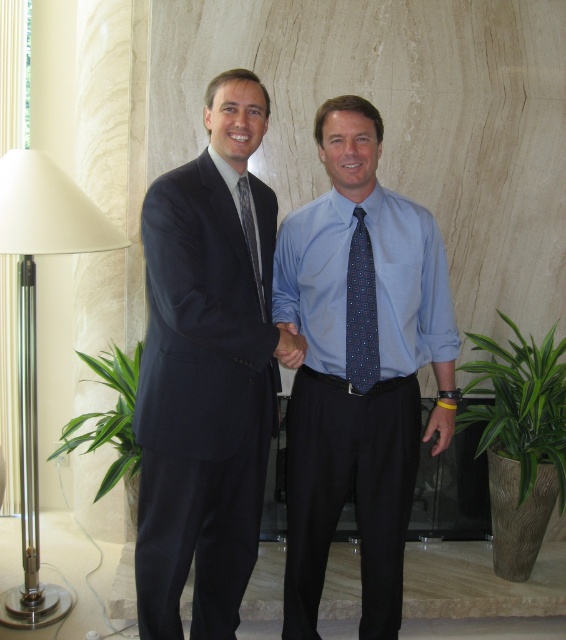
Can you confirm if blue dotted tie at center is positioned to the right of patterned silk tie at center?

Indeed, blue dotted tie at center is positioned on the right side of patterned silk tie at center.

Is blue dotted tie at center positioned behind patterned silk tie at center?

Yes, blue dotted tie at center is behind patterned silk tie at center.

Between point (361, 332) and point (250, 241), which one is positioned behind?

The point (361, 332) is more distant.

Where is `blue dotted tie at center`? The image size is (566, 640). blue dotted tie at center is located at coordinates (361, 310).

Is white glossy floor lamp at left taller than blue dotted tie at center?

Indeed, white glossy floor lamp at left has a greater height compared to blue dotted tie at center.

Is white glossy floor lamp at left further to the viewer compared to blue dotted tie at center?

Yes, it is.

The width and height of the screenshot is (566, 640). What do you see at coordinates (35, 337) in the screenshot?
I see `white glossy floor lamp at left` at bounding box center [35, 337].

This screenshot has height=640, width=566. I want to click on white glossy floor lamp at left, so click(x=35, y=337).

Does matte black suit at center appear on the right side of blue silk shirt at center?

Incorrect, matte black suit at center is not on the right side of blue silk shirt at center.

Between matte black suit at center and blue silk shirt at center, which one appears on the left side from the viewer's perspective?

matte black suit at center is more to the left.

Is point (230, 186) less distant than point (338, 256)?

Yes, it is.

At what (x,y) coordinates should I click in order to perform the action: click on matte black suit at center. Please return your answer as a coordinate pair (x, y). Looking at the image, I should click on point(205,372).